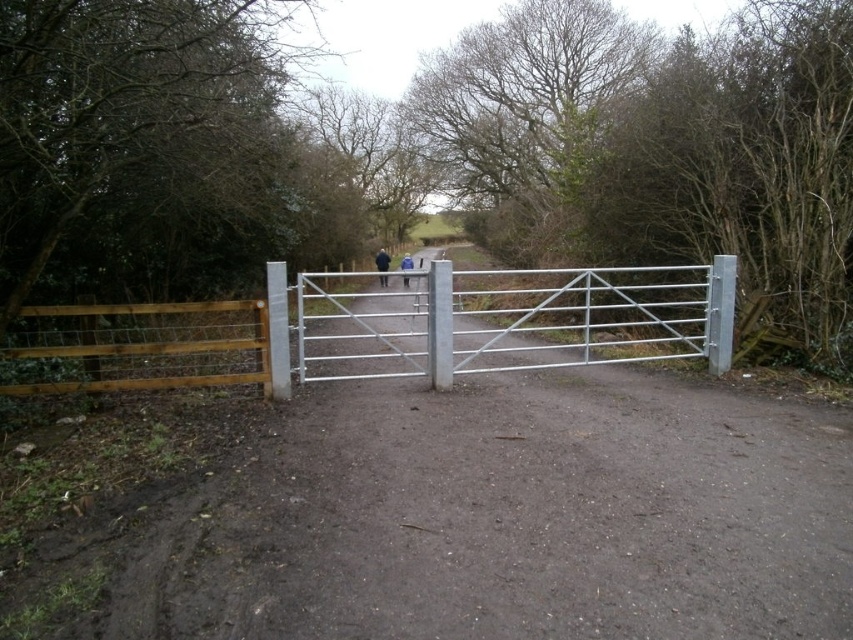
You are standing at the entrance of the rural path and want to walk towards the gate. Which point, point (387, 284) or point (404, 259), is closer to you as you approach the gate?

Point (387, 284) is closer to you because it is in front of point (404, 259) as you approach the gate.